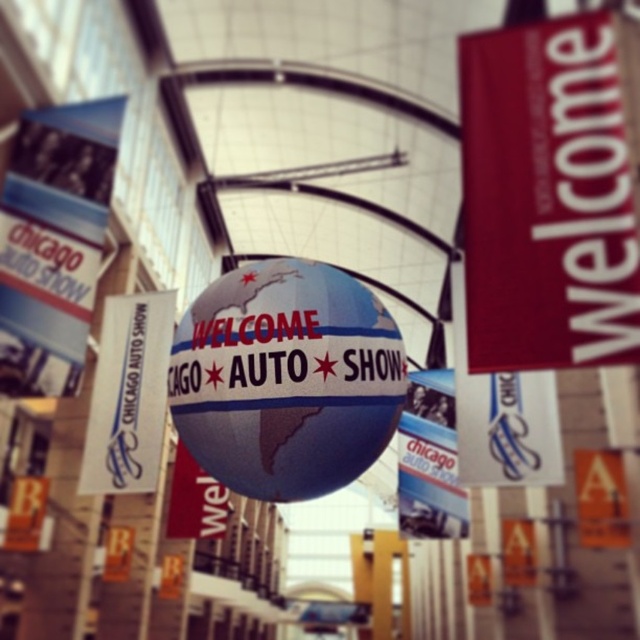
Can you confirm if red matte welcome sign at upper right is positioned to the right of shiny metallic globe at center?

Yes, red matte welcome sign at upper right is to the right of shiny metallic globe at center.

Describe the element at coordinates (547, 198) in the screenshot. I see `red matte welcome sign at upper right` at that location.

I want to click on red matte welcome sign at upper right, so click(547, 198).

Does red matte welcome sign at upper right appear under white glossy sign at center?

Incorrect, red matte welcome sign at upper right is not positioned below white glossy sign at center.

In the scene shown: Who is lower down, red matte welcome sign at upper right or white glossy sign at center?

Positioned lower is white glossy sign at center.

Is point (490, 163) behind point (86, 445)?

No, (490, 163) is in front of (86, 445).

Locate an element on the screen. The width and height of the screenshot is (640, 640). red matte welcome sign at upper right is located at coordinates (547, 198).

Is shiny metallic globe at center taller than white glossy sign at center?

Incorrect, shiny metallic globe at center's height is not larger of white glossy sign at center's.

Does point (236, 291) come in front of point (156, 344)?

Yes.

Between point (362, 387) and point (100, 449), which one is positioned behind?

Point (100, 449)

The height and width of the screenshot is (640, 640). What are the coordinates of `shiny metallic globe at center` in the screenshot? It's located at (285, 380).